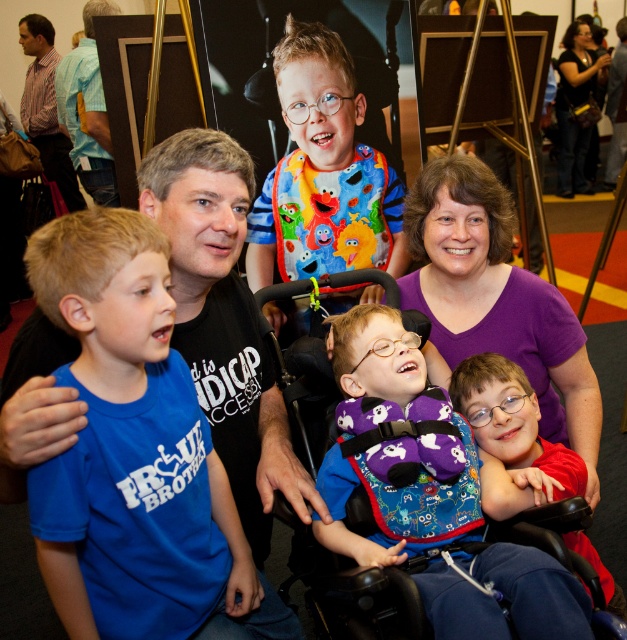
Which of these two, blue cotton shirt at left or striped cotton shirt at upper left, stands taller?

With more height is striped cotton shirt at upper left.

Does blue cotton shirt at left appear on the right side of striped cotton shirt at upper left?

Yes, blue cotton shirt at left is to the right of striped cotton shirt at upper left.

Is point (186, 538) farther from camera compared to point (38, 147)?

No, (186, 538) is in front of (38, 147).

The height and width of the screenshot is (640, 627). Find the location of `blue cotton shirt at left`. blue cotton shirt at left is located at coordinates (137, 449).

Who is higher up, blue cotton shirt at left or purple fabric at center?

blue cotton shirt at left is above.

Is point (144, 524) farther from camera compared to point (483, 394)?

That is False.

Is point (134, 612) farther from viewer compared to point (514, 413)?

No, it is in front of (514, 413).

The height and width of the screenshot is (640, 627). In order to click on blue cotton shirt at left in this screenshot , I will do `click(137, 449)`.

Does multicolored bib at center have a lesser width compared to striped cotton shirt at upper left?

In fact, multicolored bib at center might be wider than striped cotton shirt at upper left.

Which is in front, point (401, 264) or point (50, 72)?

Positioned in front is point (401, 264).

Which is behind, point (310, 51) or point (50, 67)?

The point (50, 67) is more distant.

You are a GUI agent. You are given a task and a screenshot of the screen. Output one action in this format:
    pyautogui.click(x=<x>, y=<y>)
    Task: Click on the multicolored bib at center
    This screenshot has width=627, height=640.
    Given the screenshot: What is the action you would take?
    pyautogui.click(x=324, y=172)